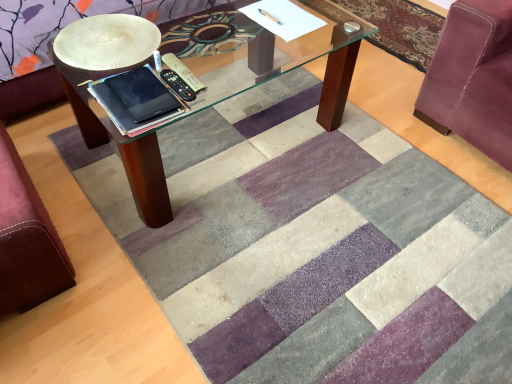
Question: Considering the relative positions of black matte tablet at center and silky purple rug at upper right in the image provided, is black matte tablet at center in front of silky purple rug at upper right?

Choices:
 (A) no
 (B) yes

Answer: (B)

Question: Is black matte tablet at center placed right next to silky purple rug at upper right?

Choices:
 (A) yes
 (B) no

Answer: (B)

Question: Does black matte tablet at center have a greater width compared to silky purple rug at upper right?

Choices:
 (A) yes
 (B) no

Answer: (B)

Question: Is black matte tablet at center smaller than silky purple rug at upper right?

Choices:
 (A) yes
 (B) no

Answer: (A)

Question: Is there a large distance between black matte tablet at center and silky purple rug at upper right?

Choices:
 (A) no
 (B) yes

Answer: (B)

Question: Would you say velvet burgundy swivel chair at lower left, the 1th swivel chair in the left-to-right sequence, is inside or outside velvet maroon swivel chair at right, marked as the 1th swivel chair in a right-to-left arrangement?

Choices:
 (A) inside
 (B) outside

Answer: (B)

Question: Looking at their shapes, would you say velvet burgundy swivel chair at lower left, which is counted as the second swivel chair, starting from the right, is wider or thinner than velvet maroon swivel chair at right, marked as the 1th swivel chair in a right-to-left arrangement?

Choices:
 (A) wide
 (B) thin

Answer: (B)

Question: Does point (10, 292) appear closer or farther from the camera than point (467, 92)?

Choices:
 (A) closer
 (B) farther

Answer: (A)

Question: From a real-world perspective, relative to velvet maroon swivel chair at right, placed as the 2th swivel chair when sorted from left to right, is velvet burgundy swivel chair at lower left, the 1th swivel chair in the left-to-right sequence, vertically above or below?

Choices:
 (A) above
 (B) below

Answer: (B)

Question: Looking at the image, does black matte tablet at center seem bigger or smaller compared to silky purple rug at upper right?

Choices:
 (A) big
 (B) small

Answer: (B)

Question: From a real-world perspective, is black matte tablet at center positioned above or below silky purple rug at upper right?

Choices:
 (A) above
 (B) below

Answer: (A)

Question: Based on their positions, is black matte tablet at center located to the left or right of silky purple rug at upper right?

Choices:
 (A) left
 (B) right

Answer: (A)

Question: Is black matte tablet at center inside the boundaries of silky purple rug at upper right, or outside?

Choices:
 (A) inside
 (B) outside

Answer: (B)

Question: In terms of width, does velvet maroon swivel chair at right, marked as the 1th swivel chair in a right-to-left arrangement, look wider or thinner when compared to velvet burgundy swivel chair at lower left, which is counted as the second swivel chair, starting from the right?

Choices:
 (A) wide
 (B) thin

Answer: (A)

Question: From a real-world perspective, is velvet maroon swivel chair at right, marked as the 1th swivel chair in a right-to-left arrangement, positioned above or below velvet burgundy swivel chair at lower left, the 1th swivel chair in the left-to-right sequence?

Choices:
 (A) below
 (B) above

Answer: (B)